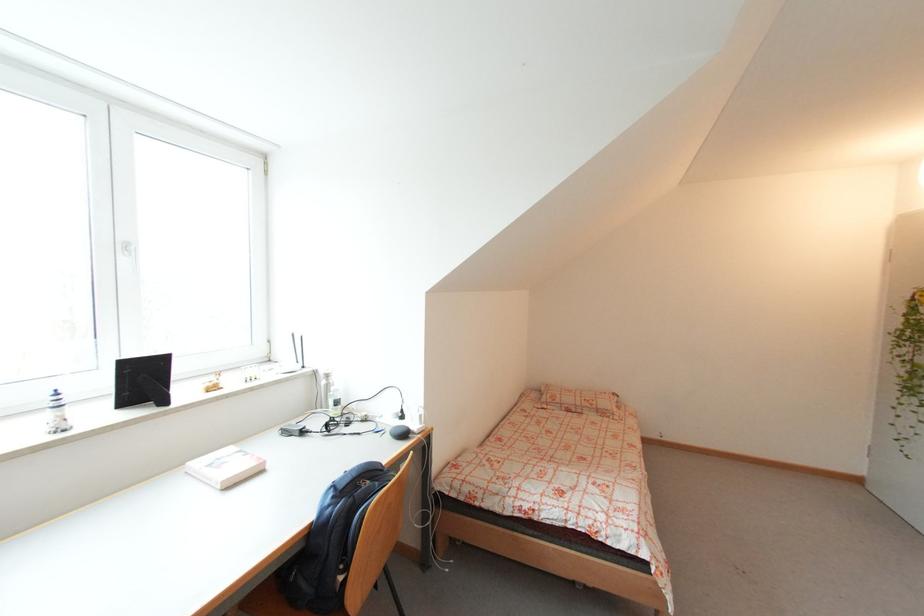
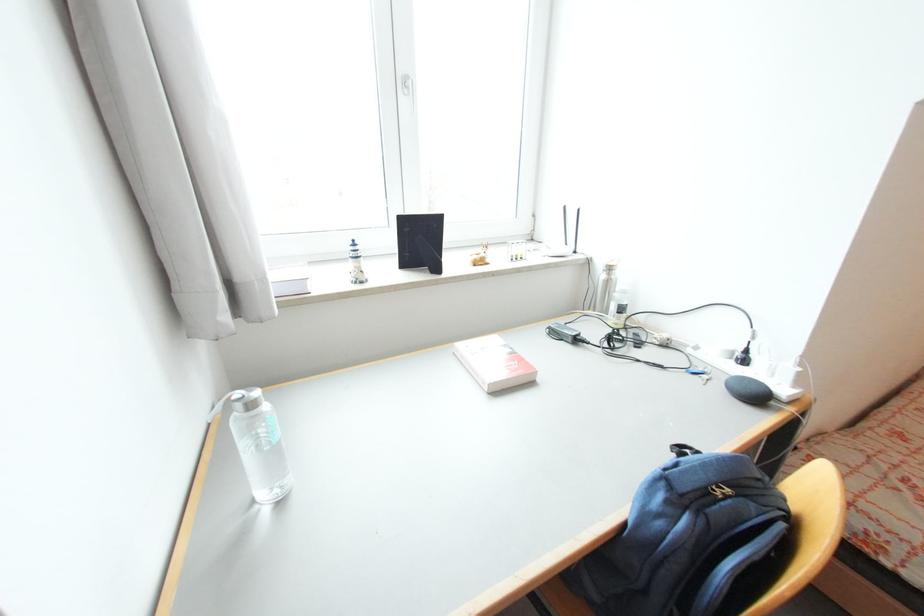
In the second image, find the point that corresponds to the point at 381,431 in the first image.

(697, 370)